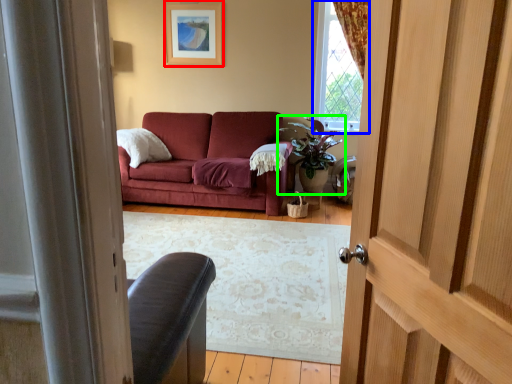
Question: Based on their relative distances, which object is farther from picture frame (highlighted by a red box)? Choose from window (highlighted by a blue box) and houseplant (highlighted by a green box).

Choices:
 (A) window
 (B) houseplant

Answer: (B)